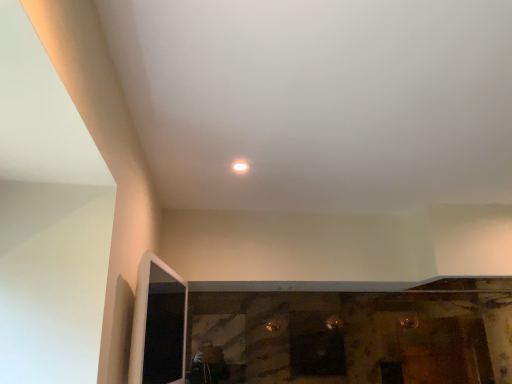
The width and height of the screenshot is (512, 384). What do you see at coordinates (240, 166) in the screenshot? I see `white glossy light at center` at bounding box center [240, 166].

The height and width of the screenshot is (384, 512). Identify the location of white glossy light at center. (240, 166).

Identify the location of transparent glass screen door at lower left. (158, 325).

What do you see at coordinates (158, 325) in the screenshot? The image size is (512, 384). I see `transparent glass screen door at lower left` at bounding box center [158, 325].

This screenshot has width=512, height=384. Find the location of `white glossy light at center`. white glossy light at center is located at coordinates (240, 166).

Is transparent glass screen door at lower left to the left of white glossy light at center from the viewer's perspective?

Yes.

Is transparent glass screen door at lower left further to camera compared to white glossy light at center?

That is False.

Is point (175, 311) less distant than point (236, 169)?

Yes, it is.

From the image's perspective, is transparent glass screen door at lower left located beneath white glossy light at center?

Correct, transparent glass screen door at lower left appears lower than white glossy light at center in the image.

From a real-world perspective, is transparent glass screen door at lower left above or below white glossy light at center?

transparent glass screen door at lower left is below white glossy light at center.

Consider the image. Looking at their sizes, would you say transparent glass screen door at lower left is wider or thinner than white glossy light at center?

transparent glass screen door at lower left is thinner than white glossy light at center.

Between transparent glass screen door at lower left and white glossy light at center, which one has more height?

Standing taller between the two is transparent glass screen door at lower left.

Who is bigger, transparent glass screen door at lower left or white glossy light at center?

Bigger between the two is transparent glass screen door at lower left.

Is white glossy light at center surrounded by transparent glass screen door at lower left?

No, white glossy light at center is not a part of transparent glass screen door at lower left.

Are transparent glass screen door at lower left and white glossy light at center far apart?

Actually, transparent glass screen door at lower left and white glossy light at center are a little close together.

Is transparent glass screen door at lower left facing away from white glossy light at center?

That's not correct — transparent glass screen door at lower left is not looking away from white glossy light at center.

How much distance is there between transparent glass screen door at lower left and white glossy light at center?

The distance of transparent glass screen door at lower left from white glossy light at center is 28.25 inches.

Identify the location of light above the transparent glass screen door at lower left (from the image's perspective). This screenshot has height=384, width=512. (240, 166).

Is white glossy light at center to the left or to the right of transparent glass screen door at lower left in the image?

Clearly, white glossy light at center is on the right of transparent glass screen door at lower left in the image.

Is white glossy light at center in front of or behind transparent glass screen door at lower left in the image?

Visually, white glossy light at center is located behind transparent glass screen door at lower left.

Is point (244, 165) behind point (148, 382)?

Yes.

From the image's perspective, is white glossy light at center above transparent glass screen door at lower left?

Indeed, from the image's perspective, white glossy light at center is shown above transparent glass screen door at lower left.

From the picture: From a real-world perspective, is white glossy light at center above or below transparent glass screen door at lower left?

Clearly, from a real-world perspective, white glossy light at center is above transparent glass screen door at lower left.

Does white glossy light at center have a greater width compared to transparent glass screen door at lower left?

Indeed, white glossy light at center has a greater width compared to transparent glass screen door at lower left.

Is white glossy light at center shorter than transparent glass screen door at lower left?

Yes.

Can you confirm if white glossy light at center is bigger than transparent glass screen door at lower left?

No.

Do you think white glossy light at center is within transparent glass screen door at lower left, or outside of it?

white glossy light at center cannot be found inside transparent glass screen door at lower left.

Would you say white glossy light at center is a long distance from transparent glass screen door at lower left?

Actually, white glossy light at center and transparent glass screen door at lower left are a little close together.

Based on the photo, is white glossy light at center looking in the opposite direction of transparent glass screen door at lower left?

No, white glossy light at center is not facing the opposite direction of transparent glass screen door at lower left.

What are the coordinates of `screen door on the left side of white glossy light at center` in the screenshot? It's located at (158, 325).

Identify the location of light lying above the transparent glass screen door at lower left (from the image's perspective). (240, 166).

Locate an element on the screen. The width and height of the screenshot is (512, 384). light that appears behind the transparent glass screen door at lower left is located at coordinates (240, 166).